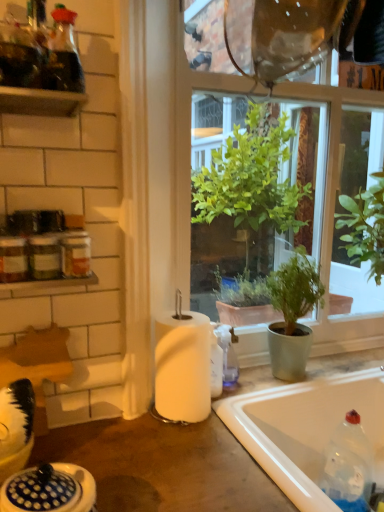
Identify the location of free space to the right of white matte paper towel at center. (249, 404).